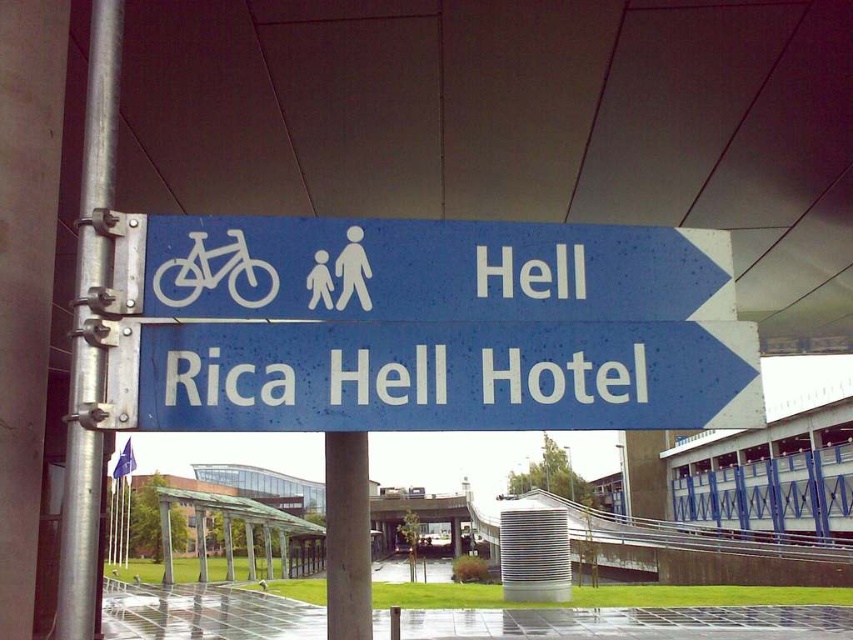
Question: Which of the following is the closest to the observer?

Choices:
 (A) white matte bicycle at left
 (B) blue plastic sign at center
 (C) blue plastic sign at upper center
 (D) silver metallic pole at left

Answer: (D)

Question: Is blue plastic sign at center closer to camera compared to white matte bicycle at left?

Choices:
 (A) yes
 (B) no

Answer: (A)

Question: Is blue plastic sign at center to the right of blue plastic sign at upper center from the viewer's perspective?

Choices:
 (A) no
 (B) yes

Answer: (B)

Question: Which object appears closest to the camera in this image?

Choices:
 (A) white matte bicycle at left
 (B) smooth concrete pillar at center

Answer: (B)

Question: Among these points, which one is farthest from the camera?

Choices:
 (A) (102, 115)
 (B) (668, 323)

Answer: (A)

Question: From the image, what is the correct spatial relationship of blue plastic sign at center in relation to silver metallic pole at left?

Choices:
 (A) below
 (B) above

Answer: (A)